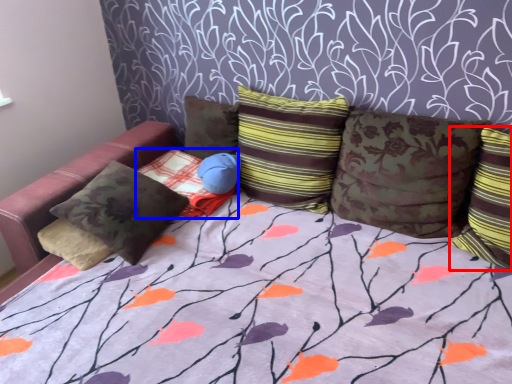
Question: Which object is closer to the camera taking this photo, pillow (highlighted by a red box) or pillow (highlighted by a blue box)?

Choices:
 (A) pillow
 (B) pillow

Answer: (A)